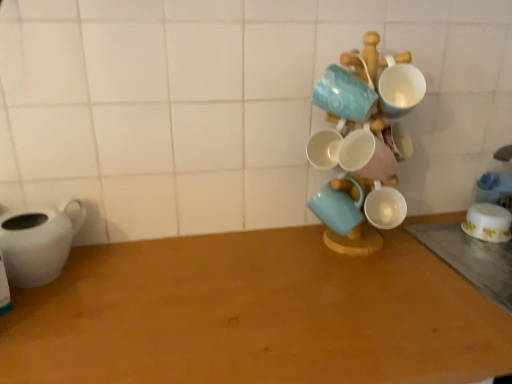
You are a GUI agent. You are given a task and a screenshot of the screen. Output one action in this format:
    pyautogui.click(x=<x>, y=<y>)
    Task: Click on the free point in front of matte ceramic mug at center, the 1th coffee cup when ordered from left to right
    The image size is (512, 384).
    Given the screenshot: What is the action you would take?
    pyautogui.click(x=351, y=294)